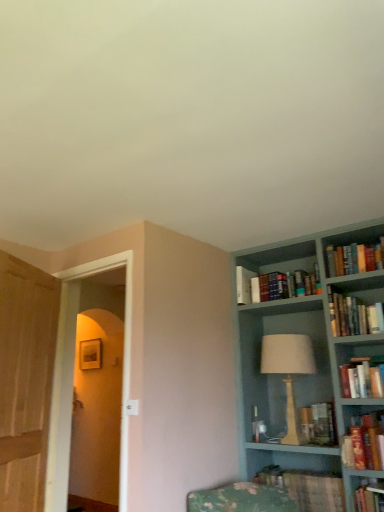
Question: Is hardcover books at upper right, positioned as the 6th book in bottom-to-top order, a part of hardcover book at lower right, acting as the first book starting from the bottom?

Choices:
 (A) yes
 (B) no

Answer: (B)

Question: Would you consider hardcover book at lower right, which is counted as the sixth book, starting from the top, to be distant from hardcover books at upper right, which is the first book from top to bottom?

Choices:
 (A) yes
 (B) no

Answer: (A)

Question: Can you confirm if hardcover book at lower right, acting as the first book starting from the bottom, is positioned to the left of hardcover books at upper right, which is the first book from top to bottom?

Choices:
 (A) no
 (B) yes

Answer: (B)

Question: From a real-world perspective, is hardcover book at lower right, which is counted as the sixth book, starting from the top, beneath hardcover books at upper right, which is the first book from top to bottom?

Choices:
 (A) yes
 (B) no

Answer: (A)

Question: Considering the relative sizes of hardcover book at lower right, which is counted as the sixth book, starting from the top, and hardcover books at upper right, which is the first book from top to bottom, in the image provided, is hardcover book at lower right, which is counted as the sixth book, starting from the top, bigger than hardcover books at upper right, which is the first book from top to bottom,?

Choices:
 (A) no
 (B) yes

Answer: (B)

Question: Considering the relative sizes of hardcover book at lower right, acting as the first book starting from the bottom, and hardcover books at upper right, which is the first book from top to bottom, in the image provided, is hardcover book at lower right, acting as the first book starting from the bottom, taller than hardcover books at upper right, which is the first book from top to bottom,?

Choices:
 (A) no
 (B) yes

Answer: (A)

Question: Does hardcover books at right, acting as the third book starting from the bottom, have a smaller size compared to hardcover books at upper right, which appears as the fifth book when ordered from the bottom?

Choices:
 (A) no
 (B) yes

Answer: (B)

Question: Is hardcover books at right, acting as the third book starting from the bottom, located outside hardcover books at upper right, which is the second book from top to bottom?

Choices:
 (A) yes
 (B) no

Answer: (A)

Question: From a real-world perspective, is hardcover books at right, acting as the third book starting from the bottom, on hardcover books at upper right, which is the second book from top to bottom?

Choices:
 (A) no
 (B) yes

Answer: (A)

Question: Considering the relative positions of hardcover books at right, acting as the fourth book starting from the top, and hardcover books at upper right, which is the second book from top to bottom, in the image provided, is hardcover books at right, acting as the fourth book starting from the top, to the right of hardcover books at upper right, which is the second book from top to bottom, from the viewer's perspective?

Choices:
 (A) no
 (B) yes

Answer: (B)

Question: Is the depth of hardcover books at right, acting as the fourth book starting from the top, greater than that of hardcover books at upper right, which appears as the fifth book when ordered from the bottom?

Choices:
 (A) yes
 (B) no

Answer: (B)

Question: Considering the relative sizes of wooden door at left, positioned as the 2th glass door in right-to-left order, and transparent glass door at left, which appears as the 2th glass door when viewed from the left, in the image provided, is wooden door at left, positioned as the 2th glass door in right-to-left order, thinner than transparent glass door at left, which appears as the 2th glass door when viewed from the left,?

Choices:
 (A) yes
 (B) no

Answer: (A)